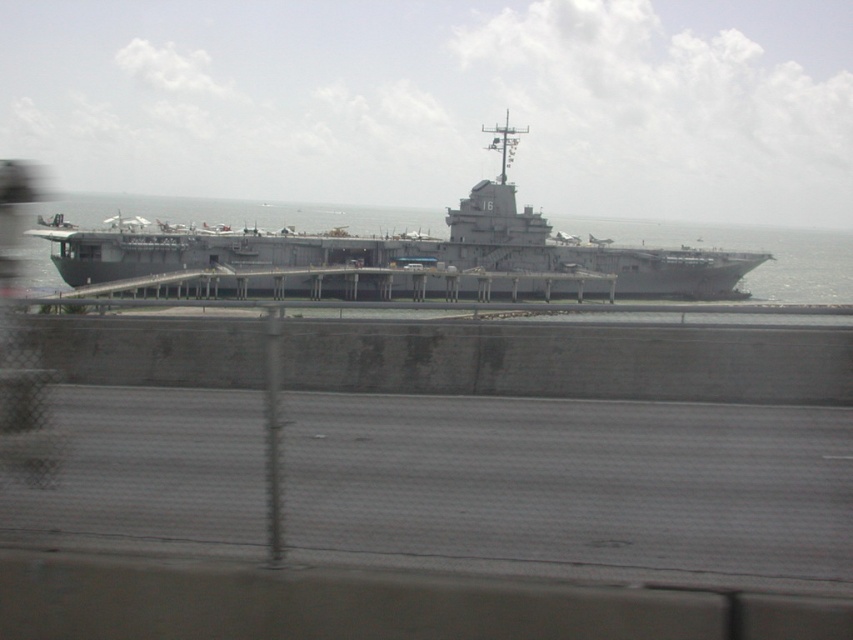
Does point (136, 244) come farther from viewer compared to point (715, 241)?

That is False.

Is gray metallic warship at center further to the viewer compared to gray metallic water at center?

Yes.

Is point (498, 145) positioned behind point (578, 227)?

No, it is not.

Where is `gray metallic warship at center`? gray metallic warship at center is located at coordinates (404, 250).